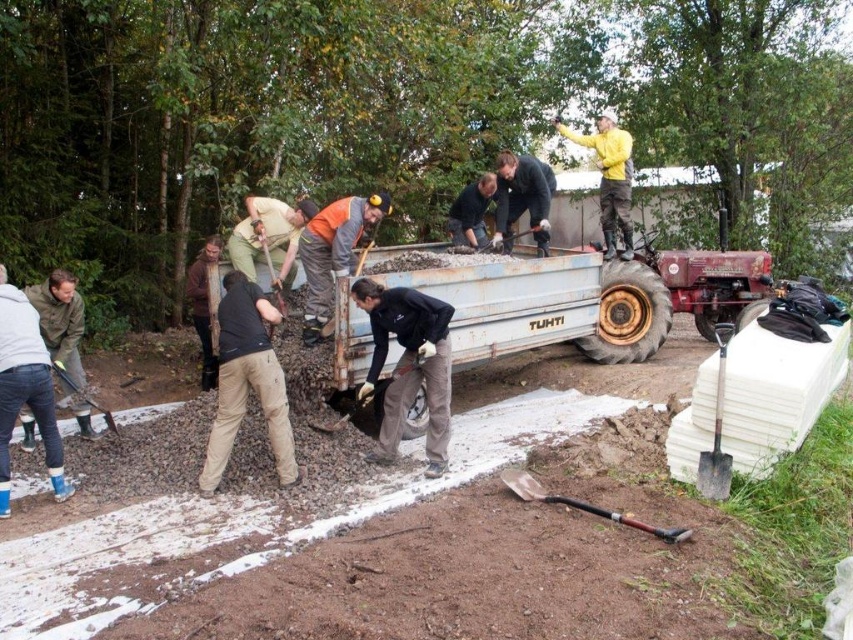
Question: Which point is closer to the camera?

Choices:
 (A) (x=556, y=500)
 (B) (x=260, y=237)
 (C) (x=74, y=387)
 (D) (x=712, y=488)

Answer: (D)

Question: Does metallic silver shovel at lower right have a smaller size compared to metallic silver shovel at lower left?

Choices:
 (A) no
 (B) yes

Answer: (B)

Question: Is black matte shirt at center positioned at the back of metallic silver shovel at lower left?

Choices:
 (A) no
 (B) yes

Answer: (B)

Question: Where is metallic silver shovel at lower left located in relation to brushed metal shovel at lower center in the image?

Choices:
 (A) right
 (B) left

Answer: (B)

Question: Which object is positioned closest to the black rubber shovel at lower center?

Choices:
 (A) metallic silver shovel at lower right
 (B) black plastic shovel at lower center

Answer: (B)

Question: Which point is farther from the camera taking this photo?

Choices:
 (A) (343, 420)
 (B) (73, 392)
 (C) (627, 518)
 (D) (267, 257)

Answer: (D)